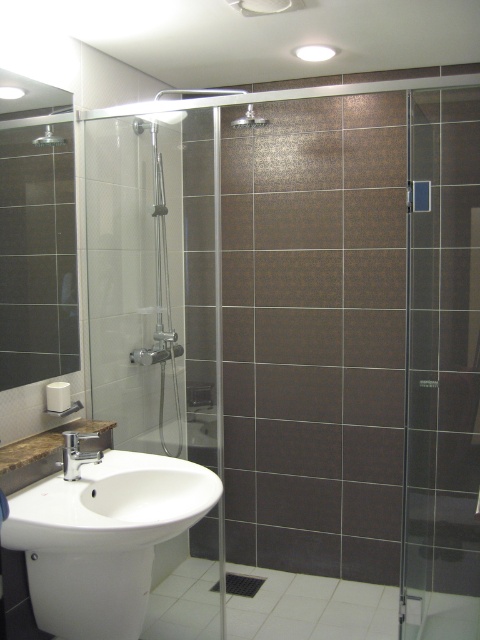
You are a contractor assessing the bathroom layout. You need to install a new grab bar that must be placed above the transparent glass shower door at center. Is the matte silver shower head at upper left in a position that would interfere with this installation?

The transparent glass shower door at center is below the matte silver shower head at upper left, so the shower head is positioned above the door. Installing the grab bar above the door may interfere with the existing shower head, so adjustments or alternative placement should be considered.

You are designing a bathroom layout and need to ensure that the matte silver faucet at lower left and the matte silver showerhead at upper center are spaced appropriately. Given that the faucet is larger, which object requires more clearance space in its immediate vicinity?

The matte silver faucet at lower left requires more clearance space in its immediate vicinity because it is bigger than the matte silver showerhead at upper center.